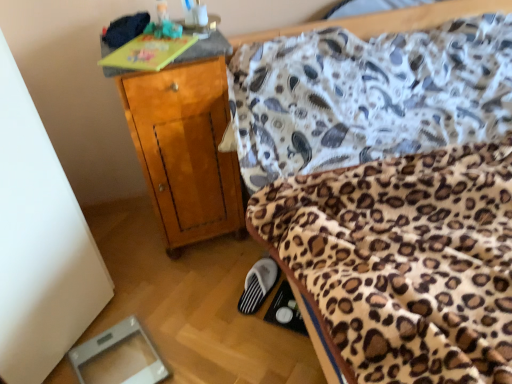
What are the coordinates of `free space between wooden nightstand at upper left and black suede slipper at lower center` in the screenshot? It's located at (218, 276).